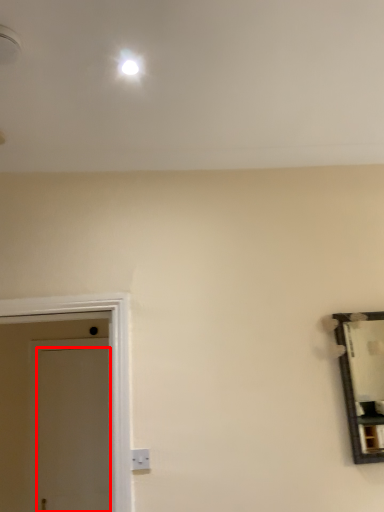
Question: Observing the image, what is the correct spatial positioning of door (annotated by the red box) in reference to electric outlet?

Choices:
 (A) left
 (B) right

Answer: (A)